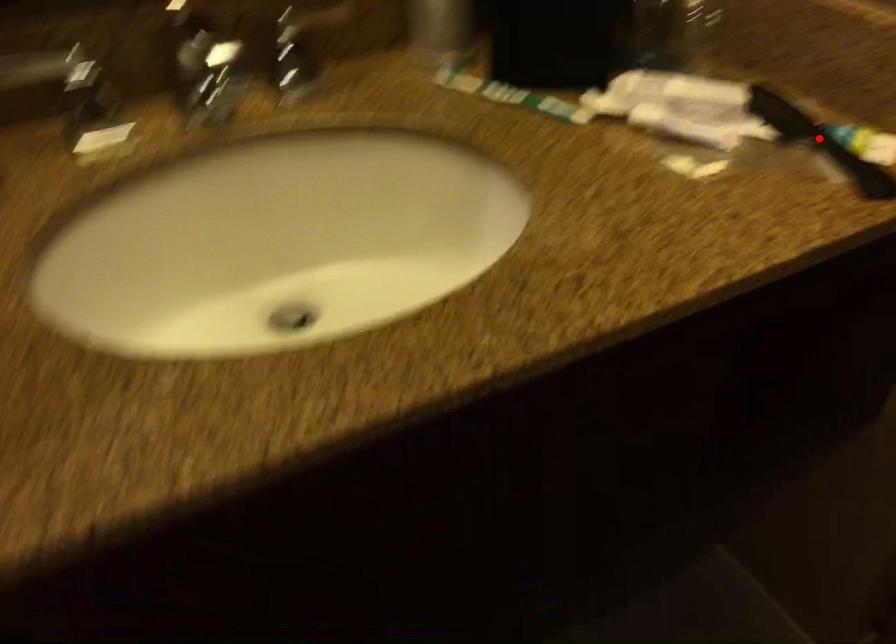
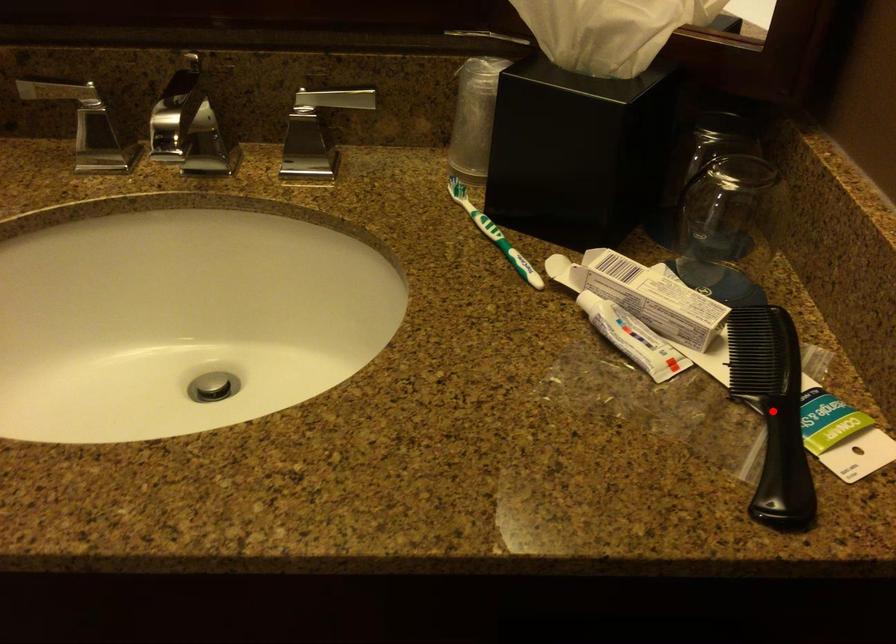
I am providing you with two images of the same scene from different viewpoints. A red point is marked on the first image and another point is marked on the second image. Is the red point in image1 aligned with the point shown in image2?

Yes